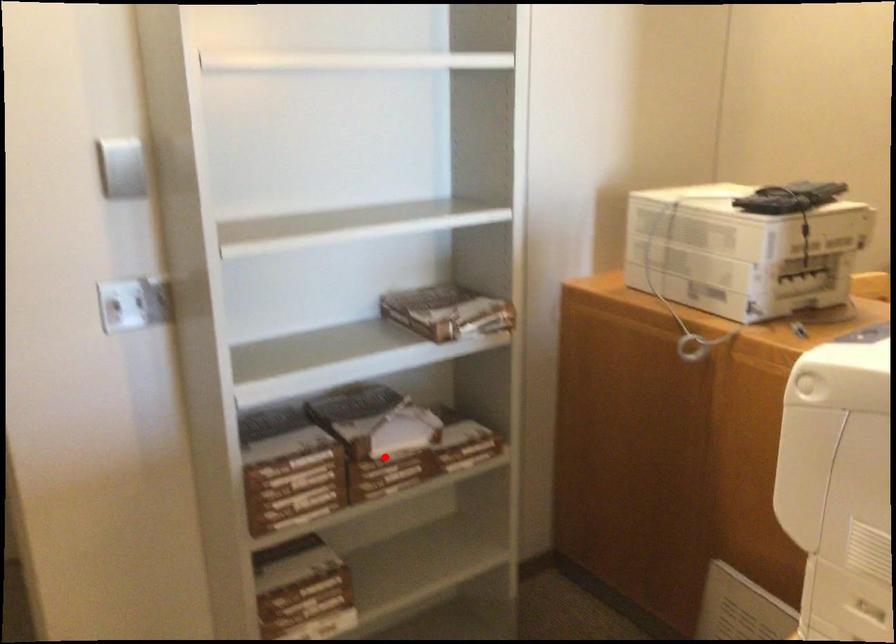
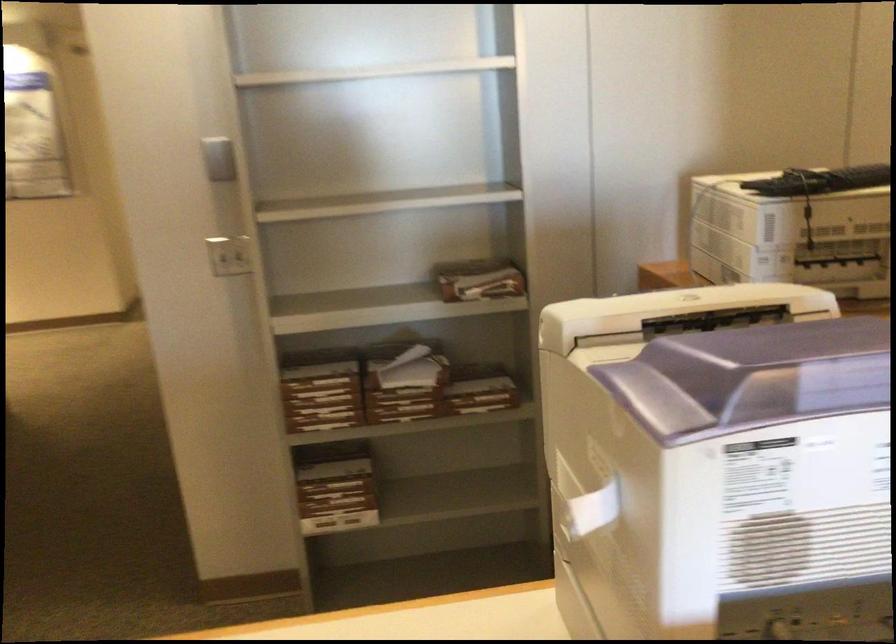
Question: I am providing you with two images of the same scene from different viewpoints. Given a red point in image1, look at the same physical point in image2. Is it:

Choices:
 (A) Closer to the viewpoint
 (B) Farther from the viewpoint

Answer: (B)